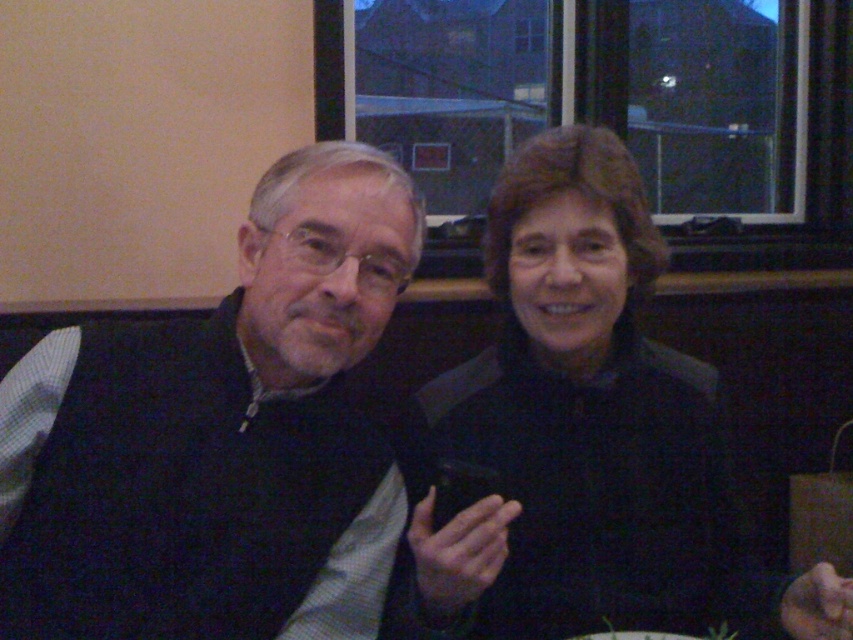
In the scene shown: Does dark blue sweater at left have a greater width compared to black matte jacket at center?

In fact, dark blue sweater at left might be narrower than black matte jacket at center.

Which is behind, point (67, 620) or point (497, 221)?

Point (497, 221)

What are the coordinates of `dark blue sweater at left` in the screenshot? It's located at (218, 436).